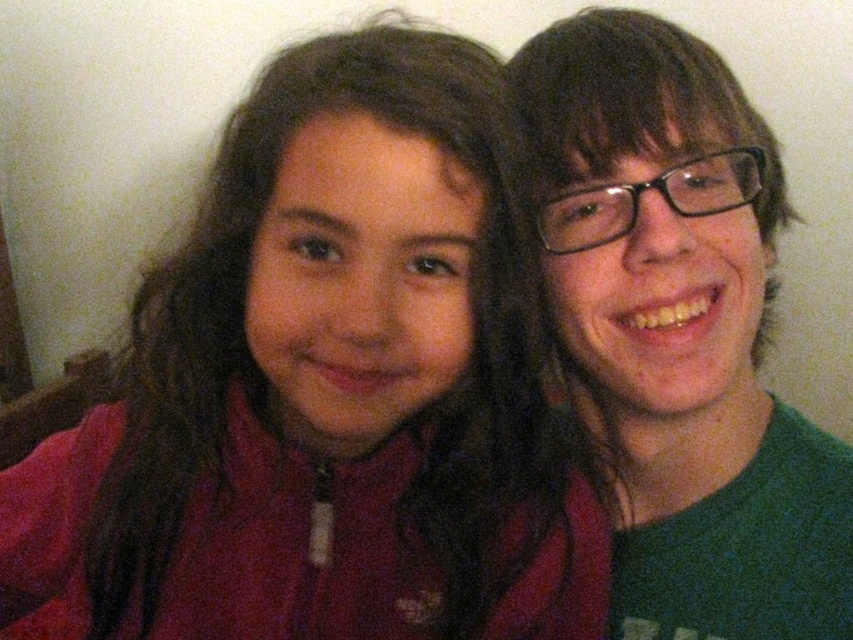
Question: Can you confirm if matte red jacket at center is bigger than green matte shirt at right?

Choices:
 (A) yes
 (B) no

Answer: (A)

Question: Does matte red jacket at center have a greater width compared to green matte shirt at right?

Choices:
 (A) no
 (B) yes

Answer: (B)

Question: Can you confirm if matte red jacket at center is positioned to the left of green matte shirt at right?

Choices:
 (A) no
 (B) yes

Answer: (B)

Question: Which object is farther from the camera taking this photo?

Choices:
 (A) matte red jacket at center
 (B) green matte shirt at right

Answer: (B)

Question: Which point is farther to the camera?

Choices:
 (A) green matte shirt at right
 (B) matte red jacket at center

Answer: (A)